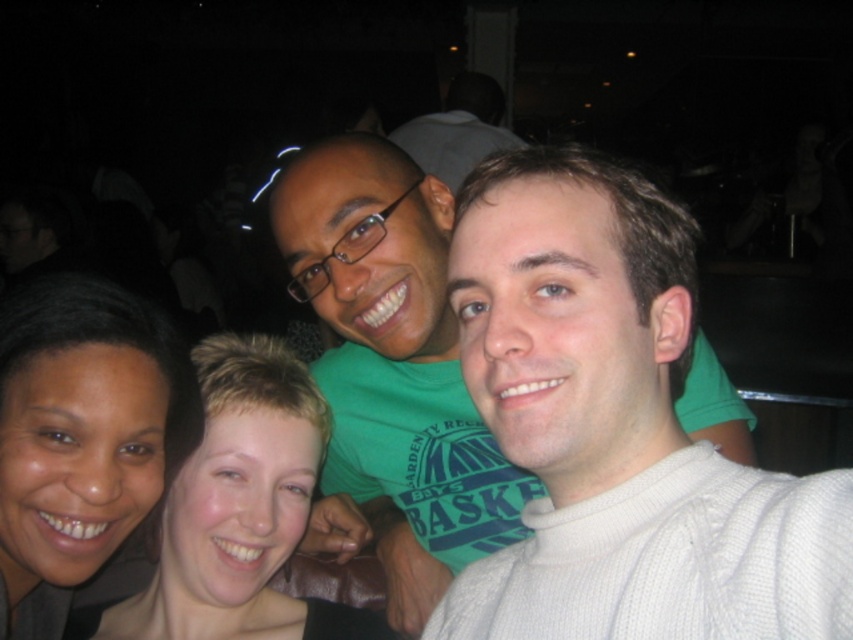
Is green matte shirt at center below dark skin tone at lower left?

Actually, green matte shirt at center is above dark skin tone at lower left.

From the picture: Is green matte shirt at center shorter than dark skin tone at lower left?

In fact, green matte shirt at center may be taller than dark skin tone at lower left.

Which is in front, point (367, 385) or point (19, 412)?

Point (19, 412) is more forward.

Image resolution: width=853 pixels, height=640 pixels. Identify the location of green matte shirt at center. (395, 365).

Which is above, green matte shirt at center or smooth skin face at center?

green matte shirt at center is higher up.

The width and height of the screenshot is (853, 640). What do you see at coordinates (395, 365) in the screenshot? I see `green matte shirt at center` at bounding box center [395, 365].

Describe the element at coordinates (395, 365) in the screenshot. I see `green matte shirt at center` at that location.

Find the location of a particular element. The height and width of the screenshot is (640, 853). green matte shirt at center is located at coordinates (395, 365).

Is dark skin tone at lower left above smooth skin face at center?

Yes, dark skin tone at lower left is above smooth skin face at center.

Based on the photo, which is above, dark skin tone at lower left or smooth skin face at center?

dark skin tone at lower left is higher up.

Where is `dark skin tone at lower left`? dark skin tone at lower left is located at coordinates (80, 435).

This screenshot has width=853, height=640. Identify the location of dark skin tone at lower left. (80, 435).